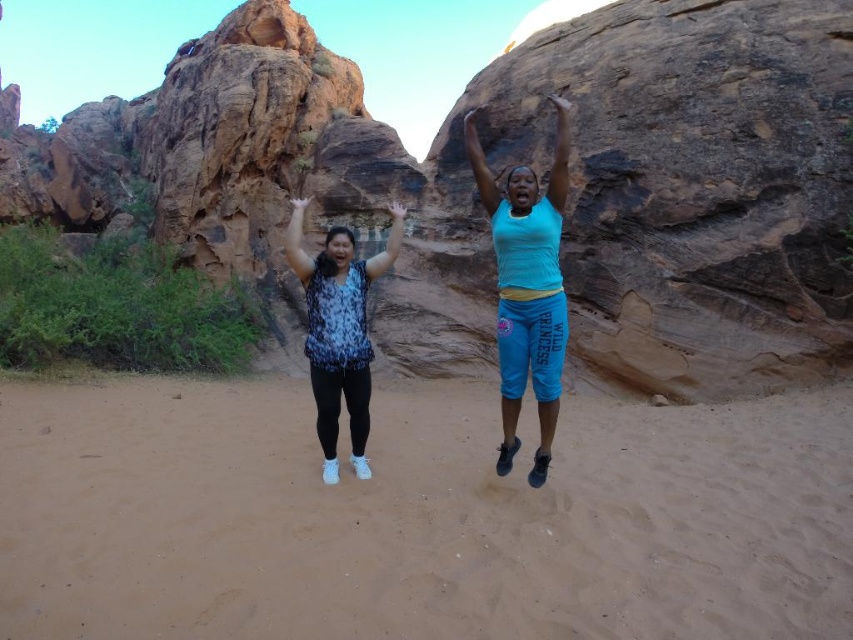
You are a photographer trying to capture the best shot of the turquoise fabric tank top at center and the matte black arm at center. Which object should you focus on first to ensure it appears sharp in the photo?

You should focus on the turquoise fabric tank top at center first because it is closer to the viewer than the matte black arm at center, ensuring it will be in focus before adjusting for the other object.

You are navigating a drone over the desert scene. The drone must avoid the blue printed blouse at center. What coordinates should the drone avoid?

The drone should avoid the coordinates point (339, 330) where the blue printed blouse at center is located.

Looking at this image, you are standing in the desert scene and want to place a small flag at the point closer to you between the two points labeled as point (332, 419) and point (370, 266). Which point should you choose?

You should choose point (332, 419) because it is closer to the viewer than point (370, 266).